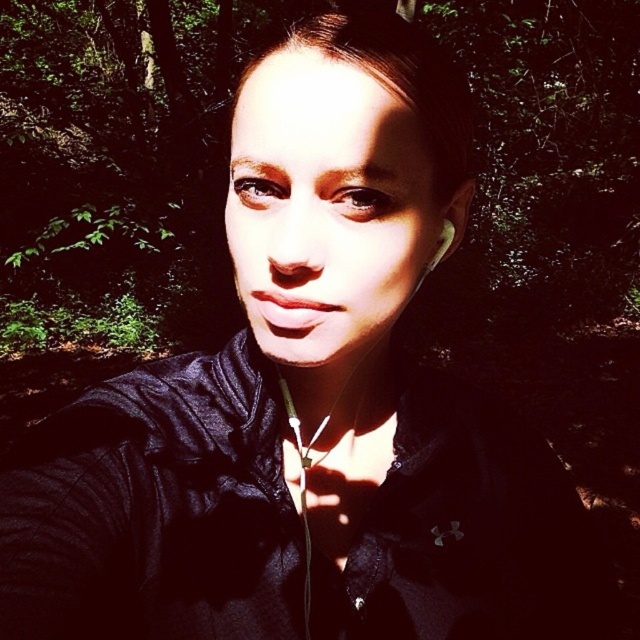
You are a photographer trying to capture a portrait of the person wearing the black matte jacket at center and the silver metallic earring at upper right. Since you want to focus on the jacket, where should you position the jacket relative to the earring to ensure it appears larger in the photo?

The black matte jacket at center is taller than the silver metallic earring at upper right, so positioning the jacket closer to the camera than the earring will make it appear larger in the photo.

You are designing a mannequin for a fashion show. The mannequin needs to wear the black matte jacket at center and have the silver metallic earring at upper right. Given the spatial relationship between these items, can the jacket and earring be displayed together without overlapping?

The black matte jacket at center is wider than the silver metallic earring at upper right, so they can be displayed together without overlapping as there is sufficient space between them.